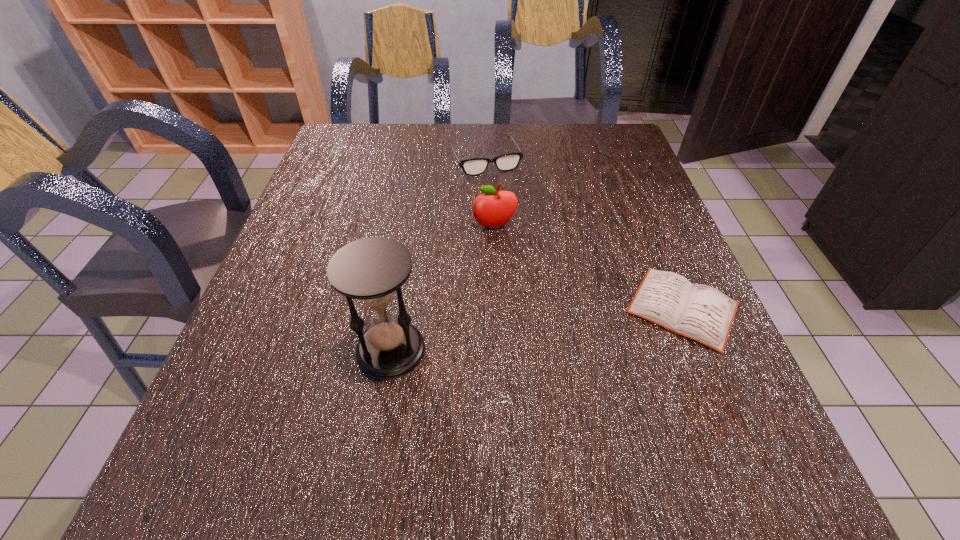
You are a GUI agent. You are given a task and a screenshot of the screen. Output one action in this format:
    pyautogui.click(x=<x>, y=<y>)
    Task: Click on the hourglass
    
    Given the screenshot: What is the action you would take?
    pyautogui.click(x=371, y=270)

Image resolution: width=960 pixels, height=540 pixels. Find the location of `the leftmost object`. the leftmost object is located at coordinates (371, 270).

Where is `diary`? The height and width of the screenshot is (540, 960). diary is located at coordinates (702, 313).

The width and height of the screenshot is (960, 540). Find the location of `the shortest object`. the shortest object is located at coordinates pyautogui.click(x=702, y=313).

Where is `the third shortest object`? the third shortest object is located at coordinates (493, 208).

The width and height of the screenshot is (960, 540). In order to click on the second farthest object in this screenshot , I will do `click(493, 208)`.

This screenshot has width=960, height=540. Identify the location of spectacles. (476, 166).

This screenshot has height=540, width=960. I want to click on the farthest object, so click(x=476, y=166).

At what (x,y) coordinates should I click in order to perform the action: click on vacant position located 0.050m on the right of the leftmost object. Please return your answer as a coordinate pair (x, y). Looking at the image, I should click on (452, 350).

The image size is (960, 540). What are the coordinates of `vacant point located on the back of the shortest object` in the screenshot? It's located at (636, 197).